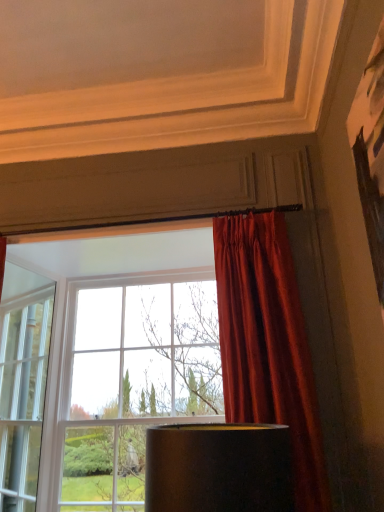
Question: Are matte glass window at center and satin red curtain at right far apart?

Choices:
 (A) yes
 (B) no

Answer: (A)

Question: Considering the relative sizes of matte glass window at center and satin red curtain at right in the image provided, is matte glass window at center shorter than satin red curtain at right?

Choices:
 (A) no
 (B) yes

Answer: (A)

Question: From a real-world perspective, is matte glass window at center on top of satin red curtain at right?

Choices:
 (A) no
 (B) yes

Answer: (A)

Question: Does matte glass window at center have a greater width compared to satin red curtain at right?

Choices:
 (A) yes
 (B) no

Answer: (A)

Question: Is matte glass window at center thinner than satin red curtain at right?

Choices:
 (A) yes
 (B) no

Answer: (B)

Question: Is matte glass window at center positioned with its back to satin red curtain at right?

Choices:
 (A) yes
 (B) no

Answer: (B)

Question: From a real-world perspective, is satin red curtain at right beneath matte glass window at center?

Choices:
 (A) no
 (B) yes

Answer: (A)

Question: Could matte glass window at center be considered to be inside satin red curtain at right?

Choices:
 (A) no
 (B) yes

Answer: (A)

Question: From a real-world perspective, is satin red curtain at right positioned over matte glass window at center based on gravity?

Choices:
 (A) yes
 (B) no

Answer: (A)

Question: Does satin red curtain at right lie in front of matte glass window at center?

Choices:
 (A) yes
 (B) no

Answer: (A)

Question: From the image's perspective, is satin red curtain at right beneath matte glass window at center?

Choices:
 (A) yes
 (B) no

Answer: (B)

Question: Is satin red curtain at right located outside matte glass window at center?

Choices:
 (A) no
 (B) yes

Answer: (B)

Question: In terms of width, does matte glass window at center look wider or thinner when compared to satin red curtain at right?

Choices:
 (A) wide
 (B) thin

Answer: (A)